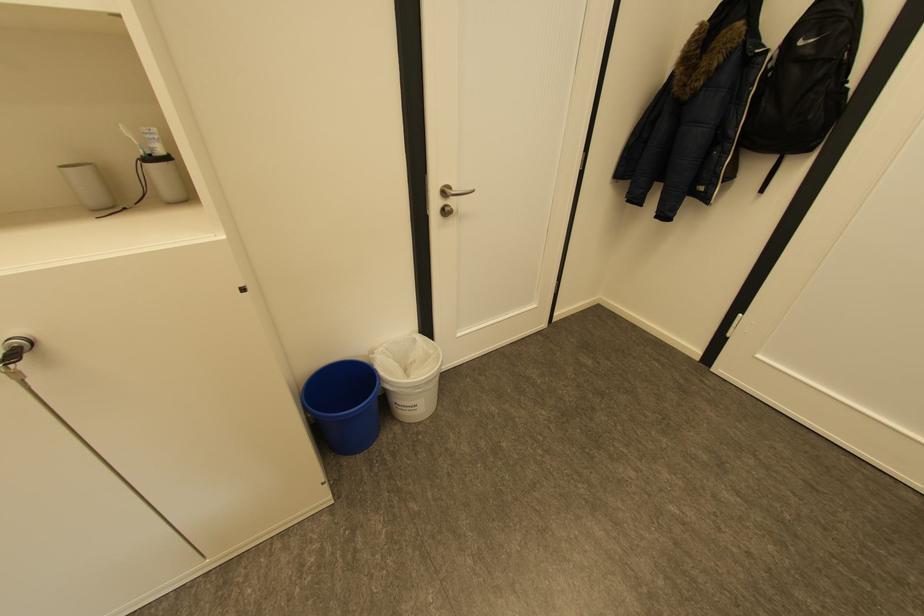
What do you see at coordinates (408, 375) in the screenshot? The width and height of the screenshot is (924, 616). I see `the white trash can` at bounding box center [408, 375].